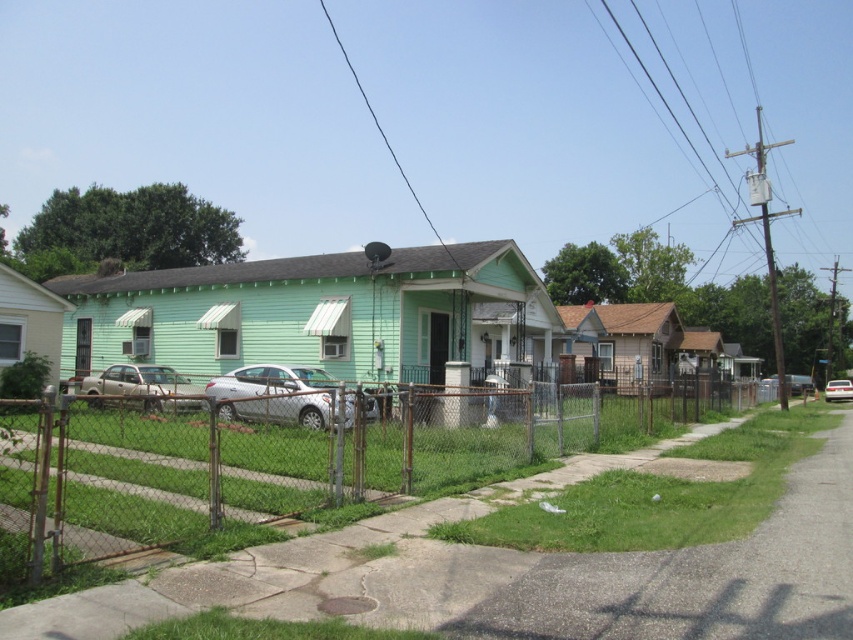
Question: Which point is closer to the camera taking this photo?

Choices:
 (A) (312, 456)
 (B) (181, 388)
 (C) (833, 388)

Answer: (A)

Question: Which of the following is the farthest from the observer?

Choices:
 (A) (225, 397)
 (B) (149, 396)

Answer: (A)

Question: Observing the image, what is the correct spatial positioning of white matte sedan at center in reference to white glossy sedan at center?

Choices:
 (A) above
 (B) below

Answer: (A)

Question: Does white matte sedan at center have a lesser width compared to matte silver sedan at left?

Choices:
 (A) no
 (B) yes

Answer: (B)

Question: Where is rusty chain-link fence at center located in relation to matte silver sedan at left in the image?

Choices:
 (A) right
 (B) left

Answer: (A)

Question: Which object is farther from the camera taking this photo?

Choices:
 (A) rusty chain-link fence at center
 (B) matte silver sedan at left

Answer: (B)